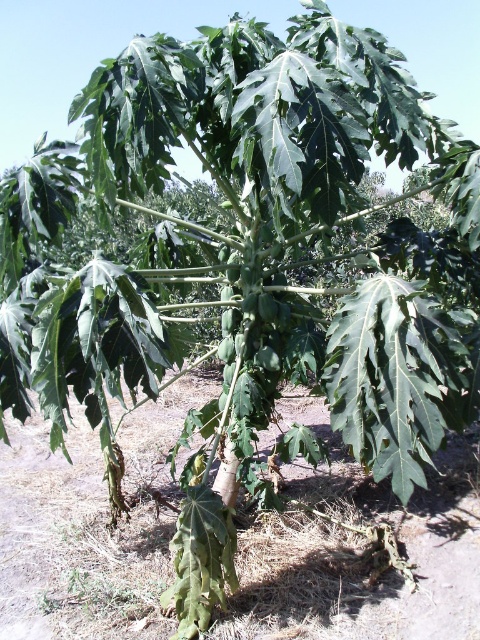
Question: Is brown dry soil at center above green matte papaya at center?

Choices:
 (A) yes
 (B) no

Answer: (B)

Question: Which of the following is the closest to the observer?

Choices:
 (A) (425, 508)
 (B) (228, 296)

Answer: (A)

Question: Can you confirm if brown dry soil at center is bigger than green matte papaya at center?

Choices:
 (A) yes
 (B) no

Answer: (A)

Question: Is brown dry soil at center smaller than green matte papaya at center?

Choices:
 (A) no
 (B) yes

Answer: (A)

Question: Which point is farther to the camera?

Choices:
 (A) brown dry soil at center
 (B) green matte papaya at center

Answer: (B)